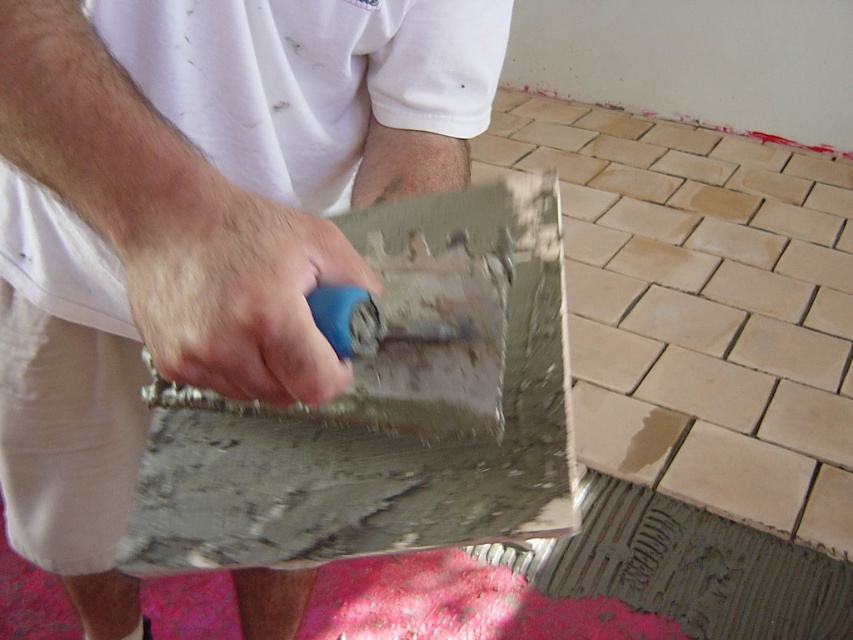
Between point (4, 364) and point (451, 321), which one is positioned behind?

The point (4, 364) is behind.

Which is below, smooth concrete trowel at center or blue plastic trowel at center?

smooth concrete trowel at center is below.

Is point (209, 198) positioned in front of point (358, 349)?

That is True.

At what (x,y) coordinates should I click in order to perform the action: click on smooth concrete trowel at center. Please return your answer as a coordinate pair (x, y). The height and width of the screenshot is (640, 853). Looking at the image, I should click on (194, 221).

What do you see at coordinates (701, 308) in the screenshot?
I see `gray matte cement at lower right` at bounding box center [701, 308].

In order to click on gray matte cement at lower right in this screenshot , I will do `click(701, 308)`.

This screenshot has height=640, width=853. In order to click on smooth concrete trowel at center in this screenshot , I will do `click(194, 221)`.

Identify the location of smooth concrete trowel at center. (194, 221).